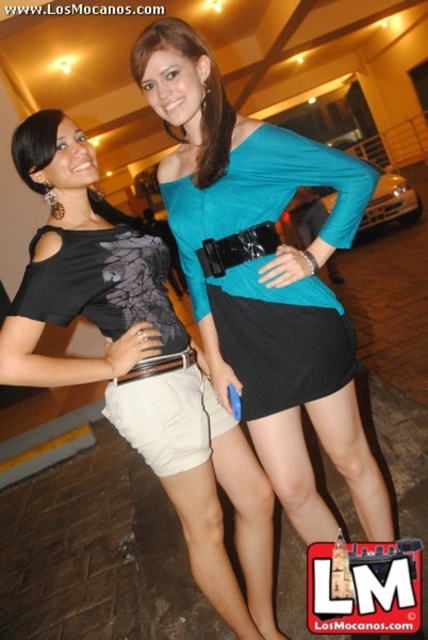
Is teal matte jersey dress at center to the left of matte black shorts at lower left from the viewer's perspective?

In fact, teal matte jersey dress at center is to the right of matte black shorts at lower left.

Is the position of teal matte jersey dress at center more distant than that of matte black shorts at lower left?

That is True.

Identify the location of teal matte jersey dress at center. (269, 250).

Is matte black shorts at lower left shorter than black matte belt at center?

No, matte black shorts at lower left is not shorter than black matte belt at center.

Looking at this image, is matte black shorts at lower left bigger than black matte belt at center?

Yes, matte black shorts at lower left is bigger than black matte belt at center.

The height and width of the screenshot is (640, 428). Describe the element at coordinates (107, 291) in the screenshot. I see `matte black shorts at lower left` at that location.

The image size is (428, 640). Find the location of `matte black shorts at lower left`. matte black shorts at lower left is located at coordinates (107, 291).

Which is above, teal matte jersey dress at center or white cotton shorts at center?

teal matte jersey dress at center is above.

Is point (202, 234) positioned after point (190, 444)?

No, it is not.

The width and height of the screenshot is (428, 640). In order to click on teal matte jersey dress at center in this screenshot , I will do tap(269, 250).